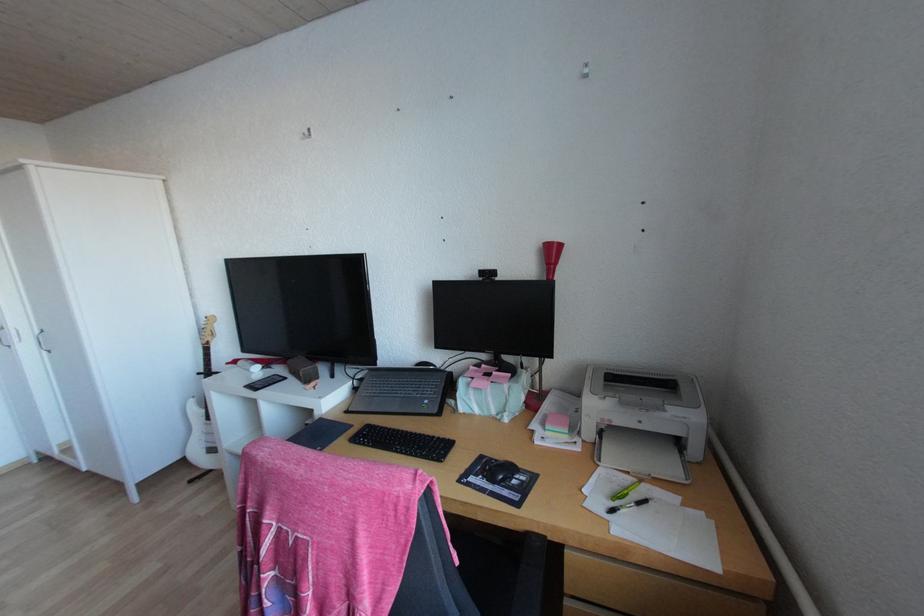
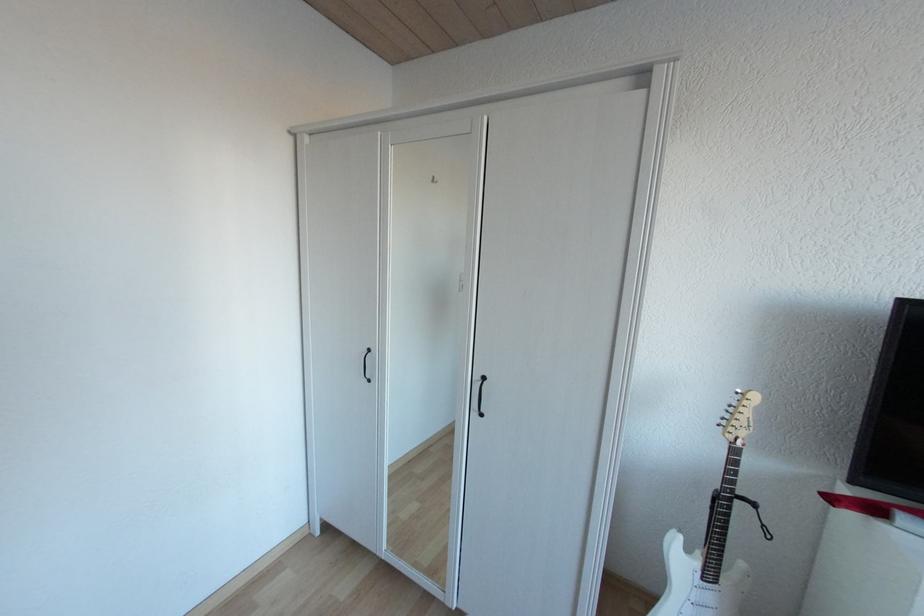
Question: In a continuous first-person perspective shot, in which direction is the camera moving?

Choices:
 (A) Left
 (B) Right
 (C) Forward
 (D) Backward

Answer: (A)